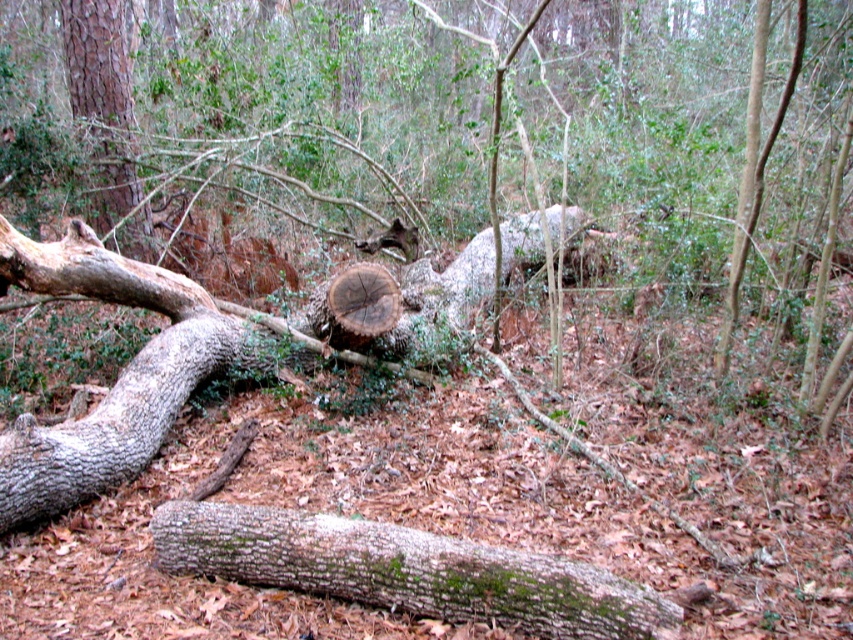
Question: Among these points, which one is nearest to the camera?

Choices:
 (A) (576, 621)
 (B) (103, 20)

Answer: (A)

Question: Is green mossy bark log at lower center to the right of smooth brown tree trunk at upper left from the viewer's perspective?

Choices:
 (A) yes
 (B) no

Answer: (A)

Question: Which object is farther from the camera taking this photo?

Choices:
 (A) green mossy bark log at lower center
 (B) smooth brown tree trunk at upper left

Answer: (B)

Question: Can you confirm if green mossy bark log at lower center is positioned to the left of smooth brown tree trunk at upper left?

Choices:
 (A) no
 (B) yes

Answer: (A)

Question: Which of the following is the closest to the observer?

Choices:
 (A) green mossy bark log at lower center
 (B) smooth brown tree trunk at upper left

Answer: (A)

Question: Is green mossy bark log at lower center smaller than smooth brown tree trunk at upper left?

Choices:
 (A) yes
 (B) no

Answer: (A)